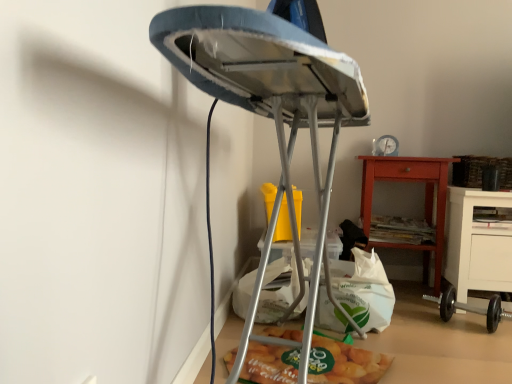
Question: Considering the relative sizes of matte orange wooden nightstand at lower right and matte plastic bag of chips at lower center in the image provided, is matte orange wooden nightstand at lower right smaller than matte plastic bag of chips at lower center?

Choices:
 (A) no
 (B) yes

Answer: (A)

Question: Can you confirm if matte orange wooden nightstand at lower right is bigger than matte plastic bag of chips at lower center?

Choices:
 (A) yes
 (B) no

Answer: (A)

Question: Is matte orange wooden nightstand at lower right thinner than matte plastic bag of chips at lower center?

Choices:
 (A) yes
 (B) no

Answer: (A)

Question: Is the surface of matte orange wooden nightstand at lower right in direct contact with matte plastic bag of chips at lower center?

Choices:
 (A) no
 (B) yes

Answer: (A)

Question: Can you confirm if matte orange wooden nightstand at lower right is positioned to the left of matte plastic bag of chips at lower center?

Choices:
 (A) yes
 (B) no

Answer: (B)

Question: Considering the relative sizes of matte orange wooden nightstand at lower right and matte plastic bag of chips at lower center in the image provided, is matte orange wooden nightstand at lower right wider than matte plastic bag of chips at lower center?

Choices:
 (A) no
 (B) yes

Answer: (A)

Question: From the image's perspective, is white paper bag at lower center on metallic ironing board at center?

Choices:
 (A) yes
 (B) no

Answer: (B)

Question: Is white paper bag at lower center located outside metallic ironing board at center?

Choices:
 (A) yes
 (B) no

Answer: (B)

Question: Is white paper bag at lower center bigger than metallic ironing board at center?

Choices:
 (A) yes
 (B) no

Answer: (B)

Question: Does white paper bag at lower center come behind metallic ironing board at center?

Choices:
 (A) no
 (B) yes

Answer: (B)

Question: Is white paper bag at lower center to the left of metallic ironing board at center from the viewer's perspective?

Choices:
 (A) yes
 (B) no

Answer: (B)

Question: Considering the relative sizes of white paper bag at lower center and metallic ironing board at center in the image provided, is white paper bag at lower center thinner than metallic ironing board at center?

Choices:
 (A) yes
 (B) no

Answer: (A)

Question: Does matte plastic bag of chips at lower center have a greater width compared to white paper bag at lower center?

Choices:
 (A) yes
 (B) no

Answer: (A)